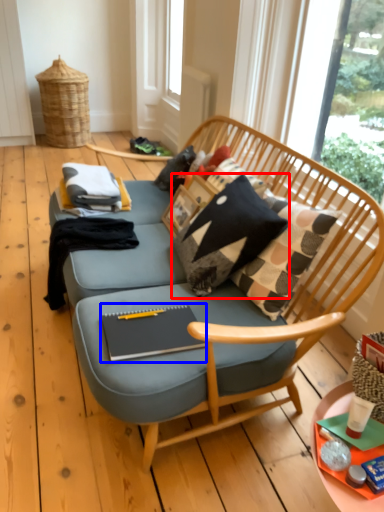
Question: Which object appears closest to the camera in this image, pillow (highlighted by a red box) or magazine (highlighted by a blue box)?

Choices:
 (A) pillow
 (B) magazine

Answer: (B)